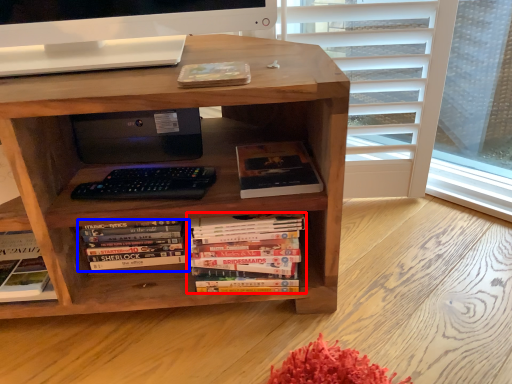
Question: Which point is closer to the camera, book (highlighted by a red box) or book (highlighted by a blue box)?

Choices:
 (A) book
 (B) book

Answer: (A)